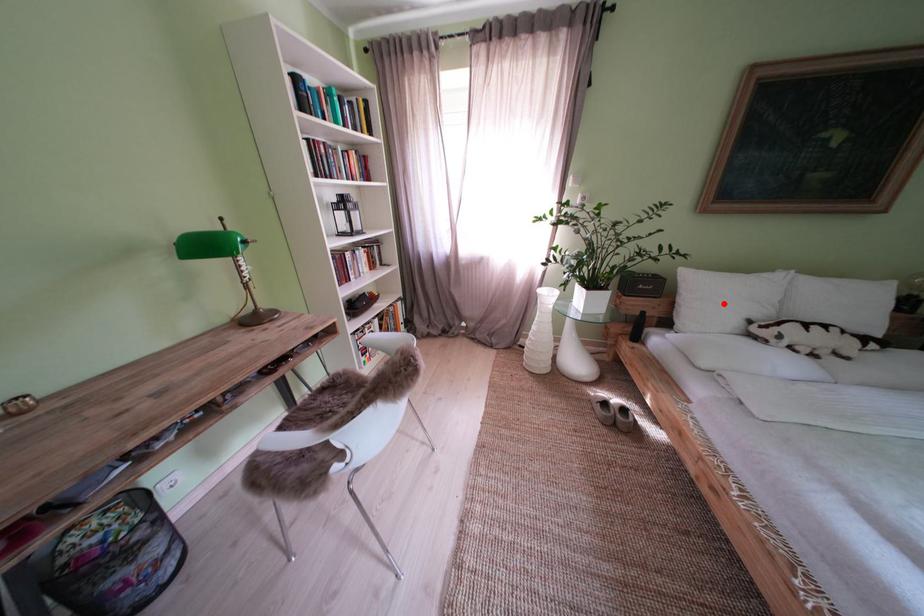
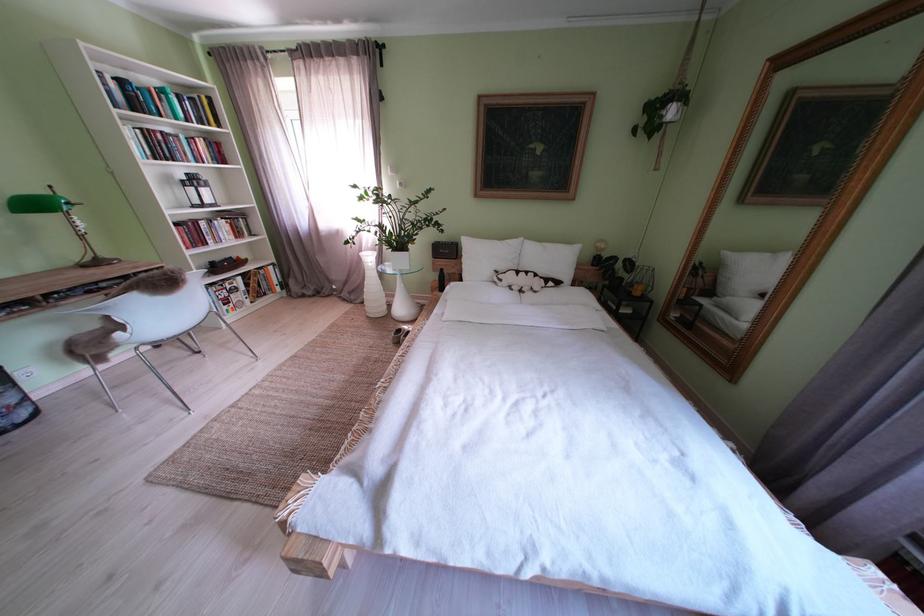
Question: I am providing you with two images of the same scene from different viewpoints. Image1 has a red point marked. In image2, the corresponding 3D location appears at what relative position? Reply with the corresponding letter.

Choices:
 (A) Closer
 (B) Farther

Answer: (A)